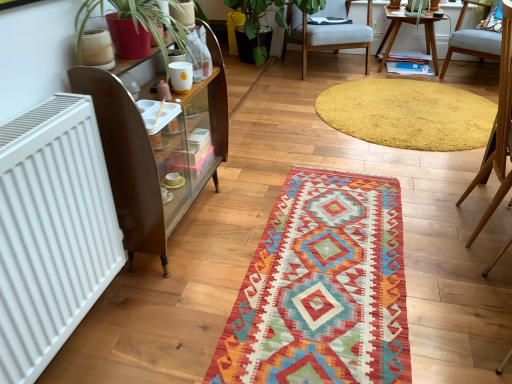
Identify the location of vacant space underneath multicolored woven mat at center, which is the 2th mat in back-to-front order (from a real-world perspective). This screenshot has width=512, height=384. point(330,258).